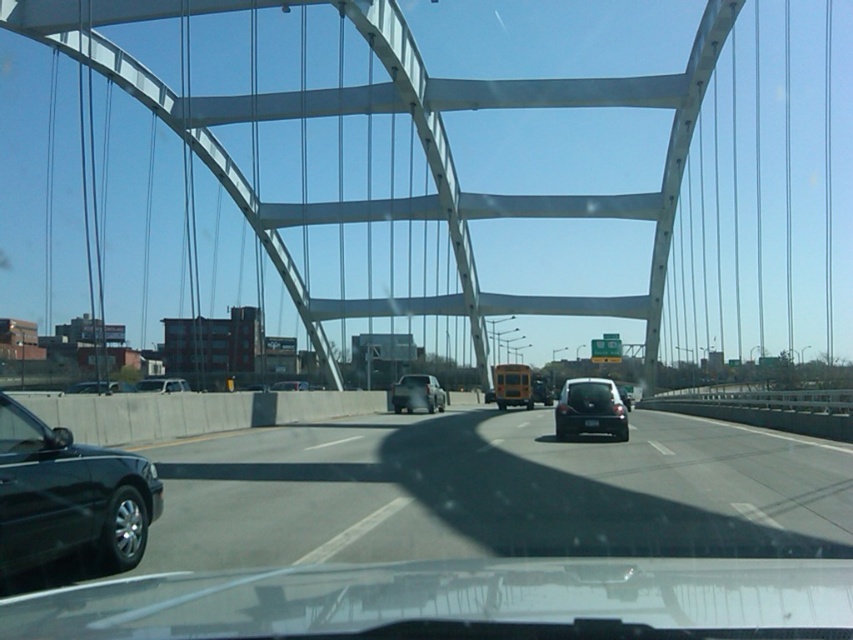
Question: Among these points, which one is nearest to the camera?

Choices:
 (A) (555, 561)
 (B) (525, 387)
 (C) (296, 384)
 (D) (422, 403)

Answer: (A)

Question: Considering the real-world distances, which object is farthest from the transparent glass windshield at center?

Choices:
 (A) yellow matte bus at center
 (B) white matte van at center
 (C) shiny black sedan at left

Answer: (A)

Question: Does transparent glass windshield at center appear on the left side of yellow matte bus at center?

Choices:
 (A) no
 (B) yes

Answer: (B)

Question: Is white metallic bridge at center thinner than matte silver suv at center?

Choices:
 (A) yes
 (B) no

Answer: (B)

Question: Is transparent glass windshield at center thinner than matte black sedan at center?

Choices:
 (A) no
 (B) yes

Answer: (A)

Question: Which object is the farthest from the shiny black sedan at left?

Choices:
 (A) transparent glass windshield at center
 (B) white matte van at center

Answer: (B)